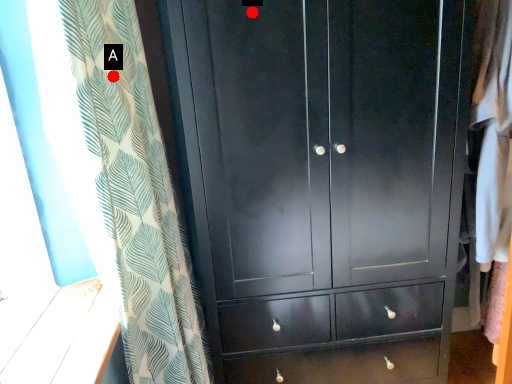
Question: Two points are circled on the image, labeled by A and B beside each circle. Among these points, which one is nearest to the camera?

Choices:
 (A) A is closer
 (B) B is closer

Answer: (A)